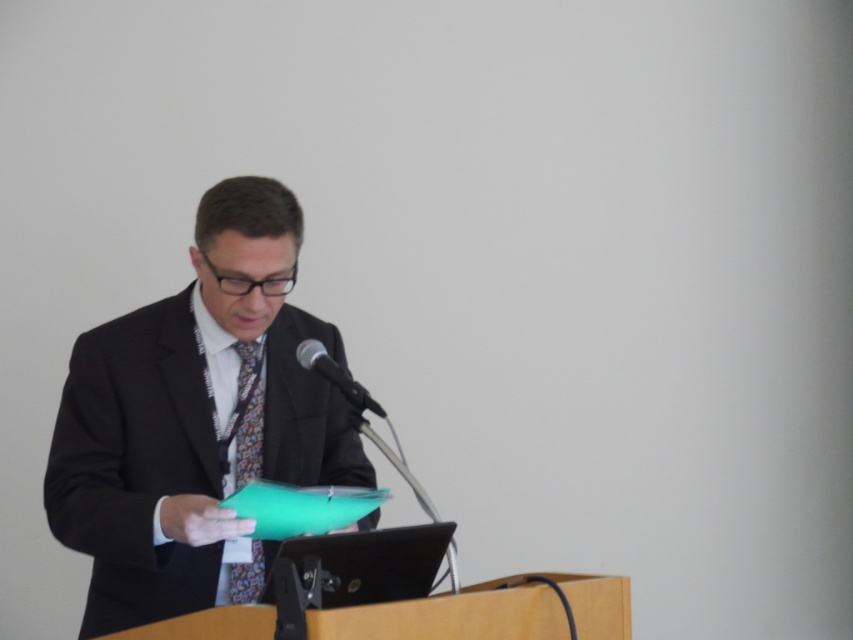
Looking at this image, you are an event organizer planning to take a photo of the speaker wearing the matte black suit at center and floral silk tie at center. To ensure both items are clearly visible, you need to know which one is wider. Can you tell me which is wider?

The matte black suit at center is wider than the floral silk tie at center according to the description.

You are a photographer at a conference. You need to place a small microphone stand at point (195, 419). The man in the matte black suit at center is giving a speech. Will placing the microphone stand at that point interfere with his space?

The point (195, 419) is on the matte black suit at center, so placing the microphone stand there would interfere with the man in the matte black suit at center as it is directly on his clothing.

You are a photographer positioned behind the podium. The man in the matte black suit at center is about to step forward to the microphone. How much space is there between him and the microphone?

The space between the matte black suit at center and the microphone is 5.75 feet, so there is enough room for him to move comfortably.